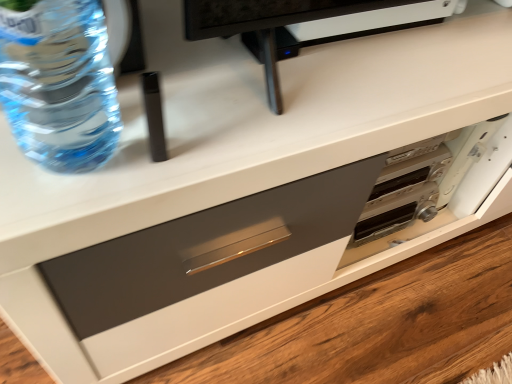
Describe the element at coordinates (191, 244) in the screenshot. I see `matte gray drawer at center` at that location.

You are a GUI agent. You are given a task and a screenshot of the screen. Output one action in this format:
    pyautogui.click(x=<x>, y=<y>)
    Task: Click on the matte gray drawer at center
    
    Given the screenshot: What is the action you would take?
    click(x=191, y=244)

What is the approximate height of translucent plastic bottle at upper left?

translucent plastic bottle at upper left is 12.30 inches in height.

Where is `translucent plastic bottle at upper left`? Image resolution: width=512 pixels, height=384 pixels. translucent plastic bottle at upper left is located at coordinates (59, 83).

This screenshot has width=512, height=384. What do you see at coordinates (59, 83) in the screenshot? I see `translucent plastic bottle at upper left` at bounding box center [59, 83].

This screenshot has height=384, width=512. Find the location of `matte gray drawer at center`. matte gray drawer at center is located at coordinates (191, 244).

Does matte gray drawer at center appear on the right side of translucent plastic bottle at upper left?

Indeed, matte gray drawer at center is positioned on the right side of translucent plastic bottle at upper left.

Is matte gray drawer at center further to the viewer compared to translucent plastic bottle at upper left?

Yes, matte gray drawer at center is behind translucent plastic bottle at upper left.

Considering the positions of point (197, 279) and point (30, 142), is point (197, 279) closer or farther from the camera than point (30, 142)?

Point (197, 279).

From the image's perspective, who appears lower, matte gray drawer at center or translucent plastic bottle at upper left?

matte gray drawer at center appears lower in the image.

From the picture: From a real-world perspective, which object stands above the other?

translucent plastic bottle at upper left, from a real-world perspective.

Does matte gray drawer at center have a lesser width compared to translucent plastic bottle at upper left?

Incorrect, the width of matte gray drawer at center is not less than that of translucent plastic bottle at upper left.

Who is taller, matte gray drawer at center or translucent plastic bottle at upper left?

Standing taller between the two is translucent plastic bottle at upper left.

Does matte gray drawer at center have a smaller size compared to translucent plastic bottle at upper left?

Incorrect, matte gray drawer at center is not smaller in size than translucent plastic bottle at upper left.

Would you say translucent plastic bottle at upper left is part of matte gray drawer at center's contents?

No, translucent plastic bottle at upper left is not a part of matte gray drawer at center.

Is the surface of matte gray drawer at center in direct contact with translucent plastic bottle at upper left?

No.

Does matte gray drawer at center turn towards translucent plastic bottle at upper left?

No, matte gray drawer at center is not turned towards translucent plastic bottle at upper left.

Can you tell me how much matte gray drawer at center and translucent plastic bottle at upper left differ in facing direction?

The angle between the facing direction of matte gray drawer at center and the facing direction of translucent plastic bottle at upper left is 0.636 degrees.

Where is `drawer behind the translucent plastic bottle at upper left`? The height and width of the screenshot is (384, 512). drawer behind the translucent plastic bottle at upper left is located at coordinates (191, 244).

Would you say translucent plastic bottle at upper left is to the left or to the right of matte gray drawer at center in the picture?

translucent plastic bottle at upper left is to the left of matte gray drawer at center.

Between translucent plastic bottle at upper left and matte gray drawer at center, which one is positioned in front?

translucent plastic bottle at upper left is closer to the camera.

Is point (90, 136) closer to camera compared to point (93, 307)?

That is True.

From the image's perspective, which is below, translucent plastic bottle at upper left or matte gray drawer at center?

From the image's view, matte gray drawer at center is below.

From a real-world perspective, which is physically above, translucent plastic bottle at upper left or matte gray drawer at center?

translucent plastic bottle at upper left is physically above.

Which object is thinner, translucent plastic bottle at upper left or matte gray drawer at center?

Thinner between the two is translucent plastic bottle at upper left.

Who is shorter, translucent plastic bottle at upper left or matte gray drawer at center?

With less height is matte gray drawer at center.

Considering the sizes of translucent plastic bottle at upper left and matte gray drawer at center in the image, is translucent plastic bottle at upper left bigger or smaller than matte gray drawer at center?

In the image, translucent plastic bottle at upper left appears to be smaller than matte gray drawer at center.

Consider the image. Which is correct: translucent plastic bottle at upper left is inside matte gray drawer at center, or outside of it?

translucent plastic bottle at upper left is outside matte gray drawer at center.

Can you see translucent plastic bottle at upper left touching matte gray drawer at center?

No, translucent plastic bottle at upper left is not touching matte gray drawer at center.

Is translucent plastic bottle at upper left aimed at matte gray drawer at center?

No, translucent plastic bottle at upper left is not turned towards matte gray drawer at center.

In the image, there is a translucent plastic bottle at upper left. At what (x,y) coordinates should I click in order to perform the action: click on drawer below it (from the image's perspective). Please return your answer as a coordinate pair (x, y). The image size is (512, 384). Looking at the image, I should click on (191, 244).

I want to click on bottle above the matte gray drawer at center (from a real-world perspective), so click(59, 83).

The width and height of the screenshot is (512, 384). Identify the location of bottle in front of the matte gray drawer at center. (59, 83).